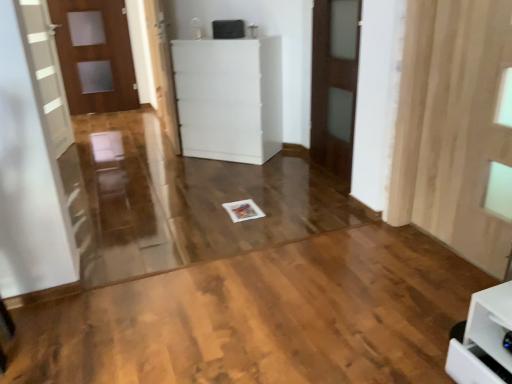
Question: Is white glossy door at center, the second door from the left, turned away from black plastic speaker at upper center?

Choices:
 (A) no
 (B) yes

Answer: (B)

Question: Can you confirm if white glossy door at center, acting as the second door starting from the back, is wider than black plastic speaker at upper center?

Choices:
 (A) yes
 (B) no

Answer: (B)

Question: From the image's perspective, is white glossy door at center, positioned as the second door in right-to-left order, located beneath black plastic speaker at upper center?

Choices:
 (A) yes
 (B) no

Answer: (A)

Question: Is black plastic speaker at upper center surrounded by white glossy door at center, which is the 2th door in front-to-back order?

Choices:
 (A) no
 (B) yes

Answer: (A)

Question: From a real-world perspective, is white glossy door at center, acting as the second door starting from the back, under black plastic speaker at upper center?

Choices:
 (A) yes
 (B) no

Answer: (A)

Question: Is white glossy door at center, acting as the second door starting from the back, located outside black plastic speaker at upper center?

Choices:
 (A) no
 (B) yes

Answer: (B)

Question: Is wooden curtain at right oriented away from white glossy door at center, the second door from the left?

Choices:
 (A) no
 (B) yes

Answer: (A)

Question: Does wooden curtain at right have a greater width compared to white glossy door at center, which is the 2th door in front-to-back order?

Choices:
 (A) no
 (B) yes

Answer: (B)

Question: Is wooden curtain at right positioned in front of white glossy door at center, which is the 2th door in front-to-back order?

Choices:
 (A) yes
 (B) no

Answer: (A)

Question: Does wooden curtain at right appear on the right side of white glossy door at center, positioned as the second door in right-to-left order?

Choices:
 (A) yes
 (B) no

Answer: (A)

Question: Can you confirm if wooden curtain at right is taller than white glossy door at center, which is the 2th door in front-to-back order?

Choices:
 (A) yes
 (B) no

Answer: (B)

Question: Would you say white glossy door at center, acting as the second door starting from the back, is part of wooden curtain at right's contents?

Choices:
 (A) no
 (B) yes

Answer: (A)

Question: From a real-world perspective, is white glossy door at center, acting as the second door starting from the back, located beneath matte wooden door at left, marked as the 1th door in a left-to-right arrangement?

Choices:
 (A) yes
 (B) no

Answer: (A)